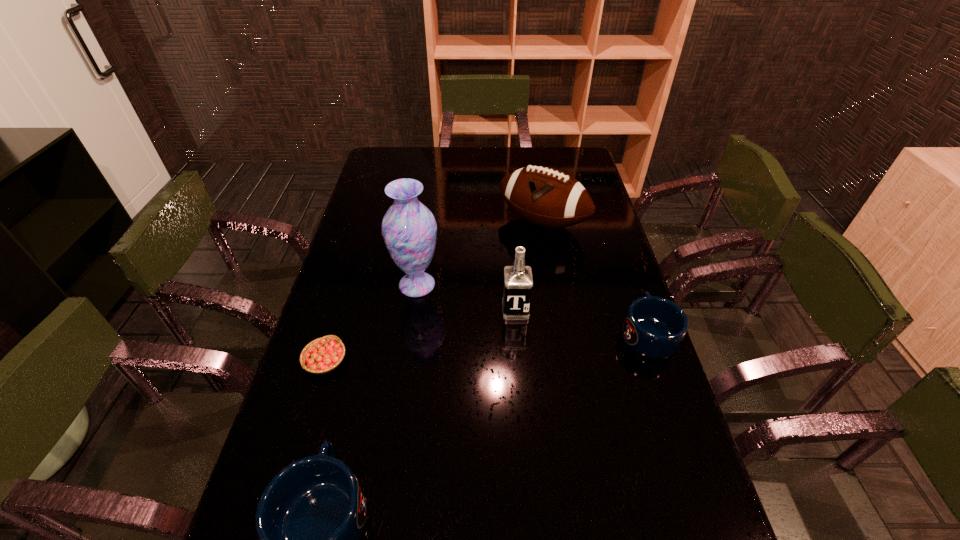
Identify the location of vacant space at the far left corner of the desktop. (382, 158).

Locate an element on the screen. Image resolution: width=960 pixels, height=540 pixels. free space at the far right corner of the desktop is located at coordinates (584, 157).

Where is `free space at the near right corner of the desktop`? Image resolution: width=960 pixels, height=540 pixels. free space at the near right corner of the desktop is located at coordinates (646, 494).

Where is `free space between the farther mug and the tallest object`? free space between the farther mug and the tallest object is located at coordinates (533, 309).

The height and width of the screenshot is (540, 960). I want to click on vacant space in between the tallest object and the shorter mug, so click(533, 309).

Locate an element on the screen. free area in between the vodka and the football (American) is located at coordinates (529, 266).

Find the location of a particular element. free space between the rightmost object and the football (American) is located at coordinates (595, 278).

Where is `empty space that is in between the farther mug and the tallest object`? The height and width of the screenshot is (540, 960). empty space that is in between the farther mug and the tallest object is located at coordinates (533, 309).

At what (x,y) coordinates should I click in order to perform the action: click on free spot between the vodka and the vase. Please return your answer as a coordinate pair (x, y). The width and height of the screenshot is (960, 540). Looking at the image, I should click on (467, 298).

Identify which object is the third nearest to the tallest object. Please provide its 2D coordinates. Your answer should be formatted as a tuple, i.e. [(x, y)], where the tuple contains the x and y coordinates of a point satisfying the conditions above.

[(546, 197)]